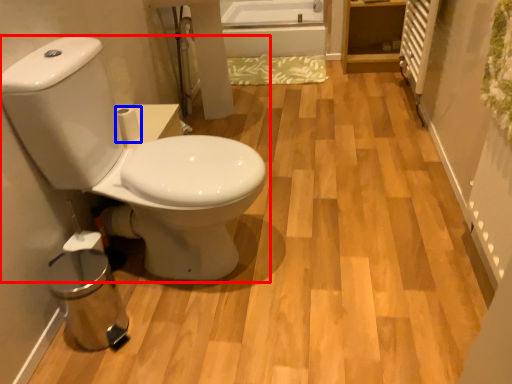
Question: Among these objects, which one is farthest to the camera, toilet (highlighted by a red box) or toilet paper (highlighted by a blue box)?

Choices:
 (A) toilet
 (B) toilet paper

Answer: (B)